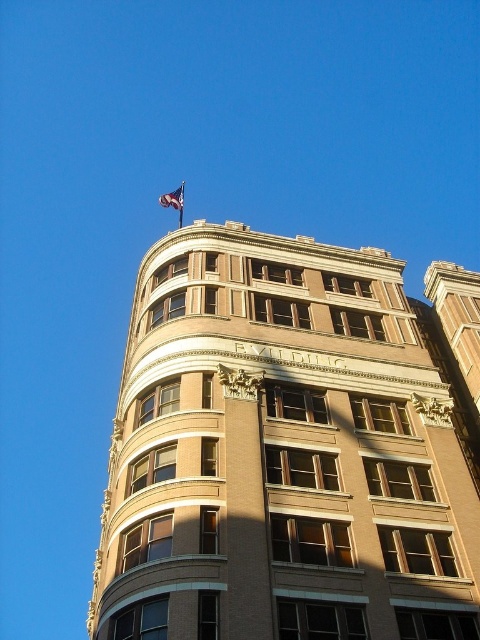
Question: Estimate the real-world distances between objects in this image. Which object is closer to the blue fabric flag at upper center?

Choices:
 (A) brown brick building at upper center
 (B) metallic flag pole at upper center

Answer: (B)

Question: Can you confirm if brown brick building at upper center is wider than metallic flag pole at upper center?

Choices:
 (A) no
 (B) yes

Answer: (B)

Question: Which point is closer to the camera taking this photo?

Choices:
 (A) (172, 205)
 (B) (181, 202)
 (C) (375, 488)

Answer: (C)

Question: Is brown brick building at upper center to the left of metallic flag pole at upper center from the viewer's perspective?

Choices:
 (A) yes
 (B) no

Answer: (A)

Question: Is brown brick building at upper center in front of metallic flag pole at upper center?

Choices:
 (A) no
 (B) yes

Answer: (B)

Question: Among these objects, which one is nearest to the camera?

Choices:
 (A) blue fabric flag at upper center
 (B) brown brick building at upper center

Answer: (B)